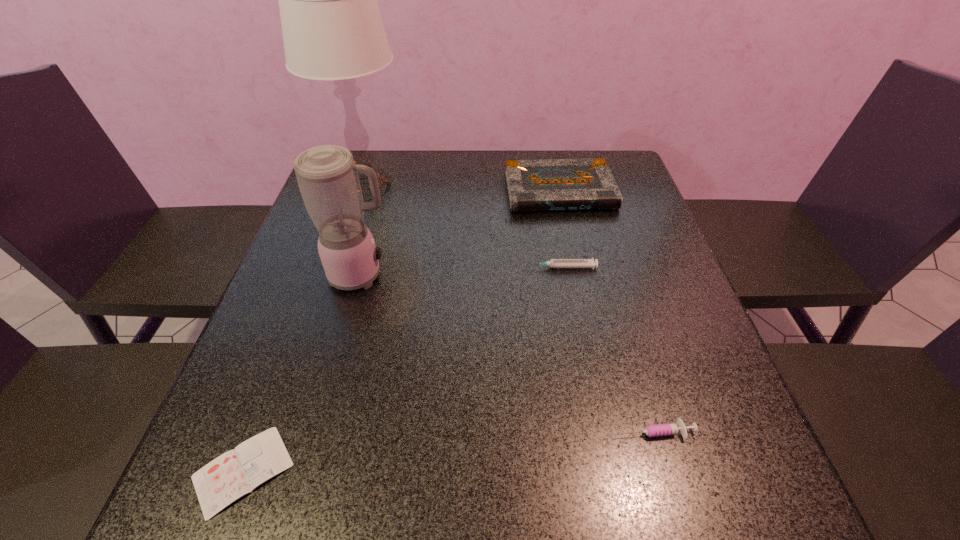
At what (x,y) coordinates should I click in order to perform the action: click on vacant space that is in between the nearer syringe and the farther syringe. Please return your answer as a coordinate pair (x, y). This screenshot has width=960, height=540. Looking at the image, I should click on (608, 349).

You are a GUI agent. You are given a task and a screenshot of the screen. Output one action in this format:
    pyautogui.click(x=<x>, y=<y>)
    Task: Click on the vacant area between the nearer syringe and the second tallest object
    This screenshot has width=960, height=540.
    Given the screenshot: What is the action you would take?
    pyautogui.click(x=508, y=353)

Locate an element on the screen. vacant area that lies between the shortest object and the second tallest object is located at coordinates (302, 373).

At what (x,y) coordinates should I click in order to perform the action: click on unoccupied area between the third tallest object and the nearer syringe. Please return your answer as a coordinate pair (x, y). The width and height of the screenshot is (960, 540). Looking at the image, I should click on (x=607, y=311).

Identify the location of vacant area that lies between the fourth shortest object and the tallest object. (464, 190).

Identify the location of free space between the nearer syringe and the tallest object. The height and width of the screenshot is (540, 960). (511, 310).

The width and height of the screenshot is (960, 540). I want to click on vacant space that is in between the table lamp and the farther syringe, so click(x=465, y=228).

At what (x,y) coordinates should I click in order to perform the action: click on free space that is in between the nearer syringe and the food processor. Please return your answer as a coordinate pair (x, y). Looking at the image, I should click on (508, 353).

In order to click on vacant space that is in between the farther syringe and the nearer syringe in this screenshot , I will do `click(608, 349)`.

You are a GUI agent. You are given a task and a screenshot of the screen. Output one action in this format:
    pyautogui.click(x=<x>, y=<y>)
    Task: Click on the empty space that is in between the food processor and the farther syringe
    
    Given the screenshot: What is the action you would take?
    pyautogui.click(x=462, y=271)